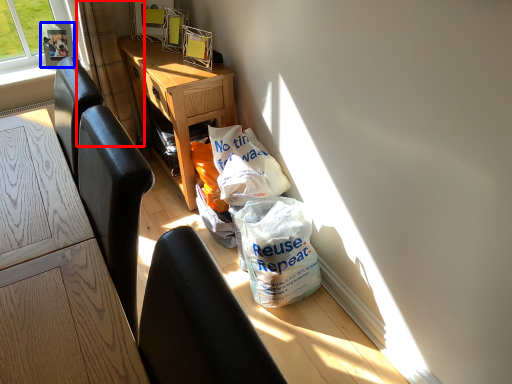
Question: Which object appears farthest to the camera in this image, curtain (highlighted by a red box) or picture frame (highlighted by a blue box)?

Choices:
 (A) curtain
 (B) picture frame

Answer: (B)